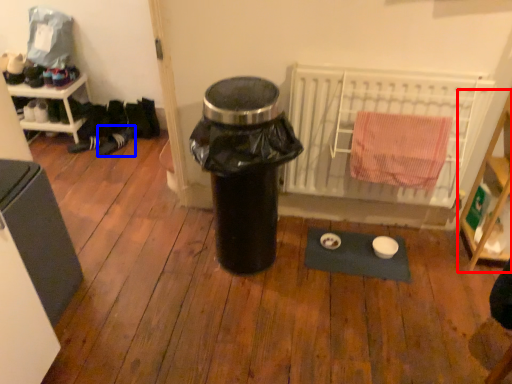
Question: Which of the following is the closest to the observer, shelf (highlighted by a red box) or shoe (highlighted by a blue box)?

Choices:
 (A) shelf
 (B) shoe

Answer: (A)